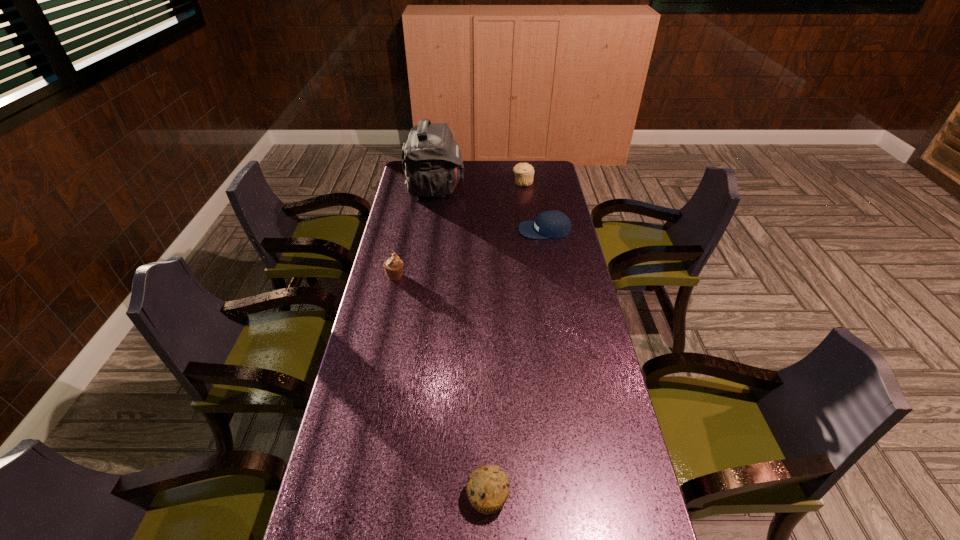
Where is `shoulder bag`? The width and height of the screenshot is (960, 540). shoulder bag is located at coordinates (432, 161).

Locate an element on the screen. Image resolution: width=960 pixels, height=540 pixels. the second farthest muffin is located at coordinates (393, 266).

Find the location of a particular element. This screenshot has height=540, width=960. the leftmost muffin is located at coordinates (393, 266).

At what (x,y) coordinates should I click in order to perform the action: click on the farthest muffin. Please return your answer as a coordinate pair (x, y). Looking at the image, I should click on (524, 172).

In order to click on baseball cap in this screenshot , I will do pos(554,224).

At what (x,y) coordinates should I click in order to perform the action: click on the second muffin from right to left. Please return your answer as a coordinate pair (x, y). The width and height of the screenshot is (960, 540). Looking at the image, I should click on (487, 488).

This screenshot has height=540, width=960. Find the location of `the shortest muffin`. the shortest muffin is located at coordinates (487, 488).

Find the location of a particular element. vacant region located 0.050m on the open flap of the shoulder bag is located at coordinates (475, 189).

This screenshot has width=960, height=540. In order to click on vacant area situated on the back of the second nearest muffin in this screenshot , I will do pyautogui.click(x=409, y=211).

I want to click on vacant area situated 0.240m on the front of the rightmost muffin, so click(x=528, y=217).